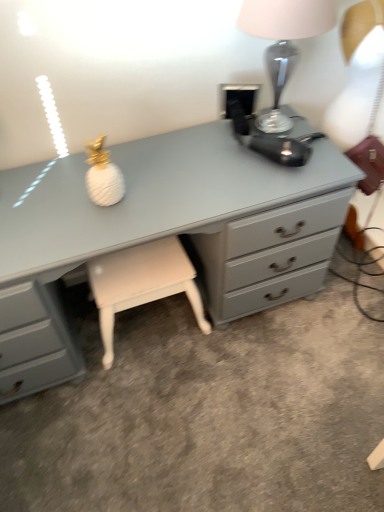
Question: From the image's perspective, is white leather stool at center located above or below satin silver lamp at upper right?

Choices:
 (A) above
 (B) below

Answer: (B)

Question: Relative to satin silver lamp at upper right, is white leather stool at center in front or behind?

Choices:
 (A) front
 (B) behind

Answer: (B)

Question: Based on their relative distances, which object is farther from the white leather stool at center?

Choices:
 (A) matte gray chest of drawers at center
 (B) satin silver lamp at upper right

Answer: (B)

Question: Estimate the real-world distances between objects in this image. Which object is closer to the white leather stool at center?

Choices:
 (A) satin silver lamp at upper right
 (B) matte gray chest of drawers at center

Answer: (B)